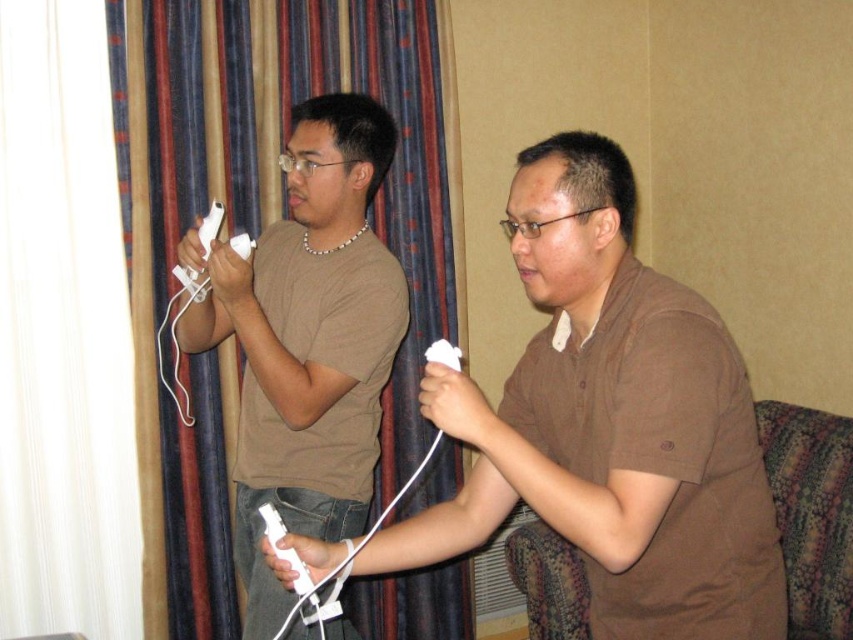
Measure the distance between brown matte shirt at center and camera.

brown matte shirt at center is 1.09 meters away from camera.

Consider the image. Can you confirm if brown matte shirt at center is positioned to the left of white matte remote at center?

No, brown matte shirt at center is not to the left of white matte remote at center.

Between point (663, 397) and point (277, 540), which one is positioned behind?

Positioned behind is point (277, 540).

This screenshot has width=853, height=640. I want to click on brown matte shirt at center, so click(610, 422).

From the picture: Can you confirm if striped fabric curtain at left is smaller than white matte remote at center?

Incorrect, striped fabric curtain at left is not smaller in size than white matte remote at center.

Is striped fabric curtain at left behind white matte remote at center?

Yes, striped fabric curtain at left is behind white matte remote at center.

Identify the location of striped fabric curtain at left. This screenshot has width=853, height=640. (265, 221).

Which is above, brown matte shirt at center or striped fabric curtain at left?

Positioned higher is striped fabric curtain at left.

Does point (553, 259) come behind point (193, 378)?

No, it is in front of (193, 378).

At what (x,y) coordinates should I click in order to perform the action: click on brown matte shirt at center. Please return your answer as a coordinate pair (x, y). Looking at the image, I should click on point(610,422).